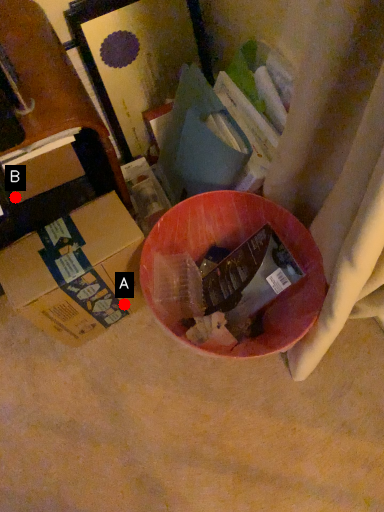
Question: Two points are circled on the image, labeled by A and B beside each circle. Which point is closer to the camera taking this photo?

Choices:
 (A) A is closer
 (B) B is closer

Answer: (B)